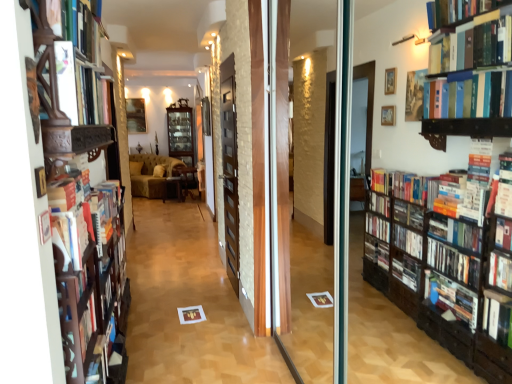
The width and height of the screenshot is (512, 384). What are the coordinates of `vacant space behind matte brown paper at center` in the screenshot? It's located at (207, 301).